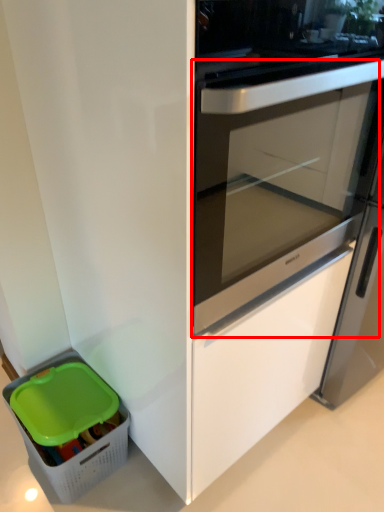
Question: From the image's perspective, where is screen door (annotated by the red box) located relative to storage box?

Choices:
 (A) below
 (B) above

Answer: (B)